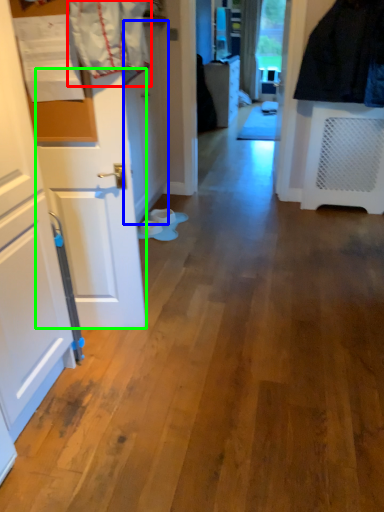
Question: Which is nearer to the laundry (highlighted by a red box)? door (highlighted by a blue box) or door (highlighted by a green box).

Choices:
 (A) door
 (B) door

Answer: (B)